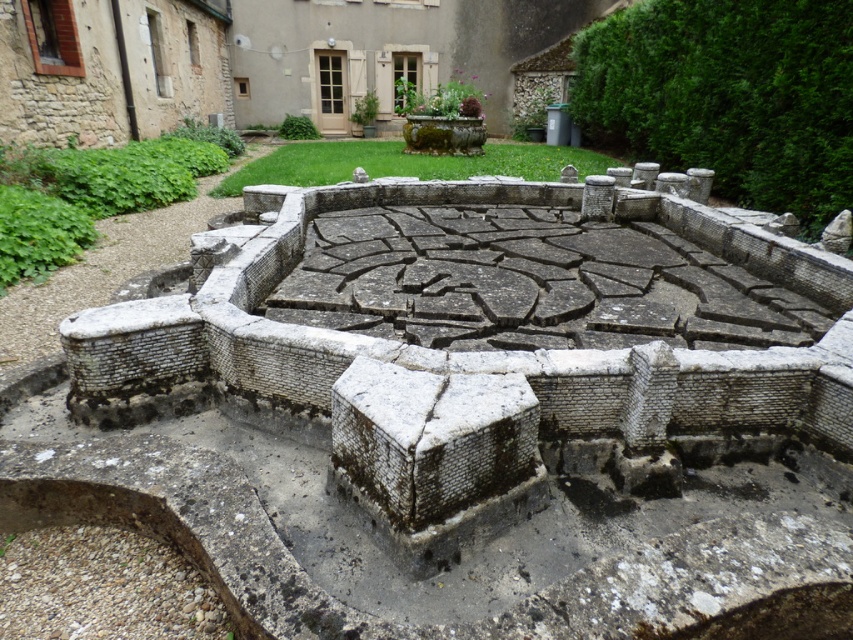
Question: Which is nearer to the green leafy plant at left?

Choices:
 (A) gray stone wall at upper right
 (B) gray stone maze at center
 (C) rough stone fountain at center

Answer: (C)

Question: Does gray stone maze at center appear on the left side of gray stone wall at upper right?

Choices:
 (A) yes
 (B) no

Answer: (A)

Question: Which object appears farthest from the camera in this image?

Choices:
 (A) gray stone wall at upper right
 (B) gray stone maze at center
 (C) green leafy plant at left

Answer: (A)

Question: Does gray stone wall at upper right have a lesser width compared to green leafy plant at left?

Choices:
 (A) yes
 (B) no

Answer: (A)

Question: Which point is farther to the camera?

Choices:
 (A) 39,218
 (B) 581,506

Answer: (A)

Question: Where is green leafy plant at left located in relation to rough stone fountain at center in the image?

Choices:
 (A) below
 (B) above

Answer: (A)